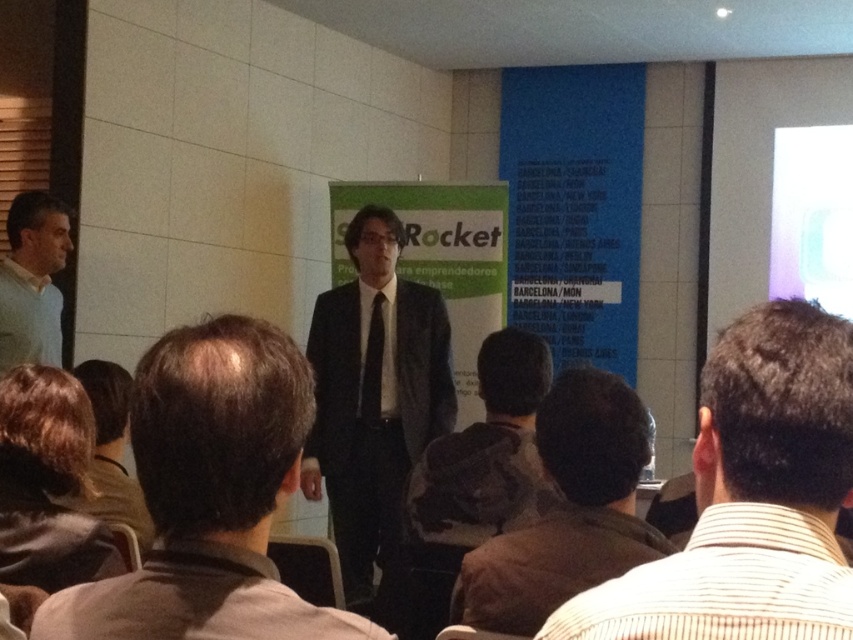
Is dark brown suit at center above brown fabric jacket at lower right?

Yes.

Is point (242, 508) behind point (546, 598)?

No.

Between point (293, 348) and point (560, 406), which one is positioned behind?

The point (560, 406) is more distant.

Identify the location of dark brown suit at center. The height and width of the screenshot is (640, 853). (210, 497).

Who is higher up, dark gray suit at center or brown hair at lower left?

brown hair at lower left is above.

Is point (434, 403) in front of point (78, 561)?

That is False.

What do you see at coordinates (374, 396) in the screenshot? I see `dark gray suit at center` at bounding box center [374, 396].

Image resolution: width=853 pixels, height=640 pixels. I want to click on dark gray suit at center, so click(x=374, y=396).

Image resolution: width=853 pixels, height=640 pixels. I want to click on dark gray suit at center, so click(374, 396).

Is dark gray suit at center further to camera compared to light blue sweater at left?

No, it is not.

The height and width of the screenshot is (640, 853). Describe the element at coordinates (374, 396) in the screenshot. I see `dark gray suit at center` at that location.

You are a GUI agent. You are given a task and a screenshot of the screen. Output one action in this format:
    pyautogui.click(x=<x>, y=<y>)
    Task: Click on the dark gray suit at center
    
    Given the screenshot: What is the action you would take?
    pyautogui.click(x=374, y=396)